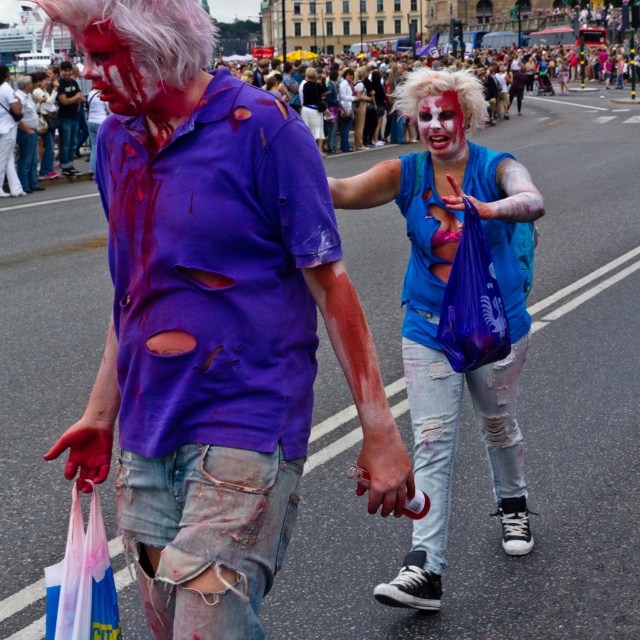
Question: Can you confirm if blue ripped jeans at center is wider than matte white face at upper left?

Choices:
 (A) yes
 (B) no

Answer: (A)

Question: Which point is closer to the camera taking this photo?

Choices:
 (A) (237, 106)
 (B) (84, 35)
 (C) (74, 100)
 (D) (460, 116)

Answer: (B)

Question: Is matte white face at upper left positioned behind matte white face at center?

Choices:
 (A) no
 (B) yes

Answer: (A)

Question: Estimate the real-world distances between objects in this image. Which object is closer to the matte white face at center?

Choices:
 (A) ripped denim shorts at center
 (B) matte purple shirt at center
 (C) matte white face at upper left

Answer: (B)

Question: Which of the following is the closest to the observer?

Choices:
 (A) matte white face at center
 (B) ripped denim shorts at center

Answer: (A)

Question: Is the position of blue ripped jeans at center more distant than that of matte white face at center?

Choices:
 (A) yes
 (B) no

Answer: (B)